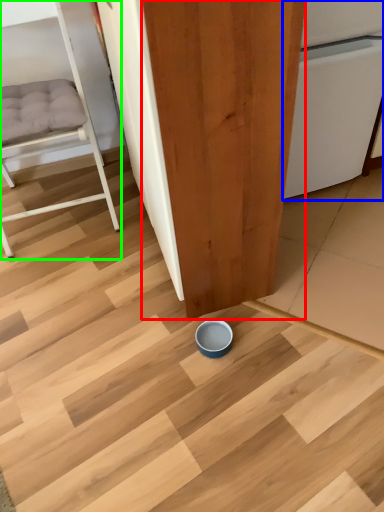
Question: Estimate the real-world distances between objects in this image. Which object is closer to plywood (highlighted by a red box), dish washer (highlighted by a blue box) or furniture (highlighted by a green box)?

Choices:
 (A) dish washer
 (B) furniture

Answer: (A)